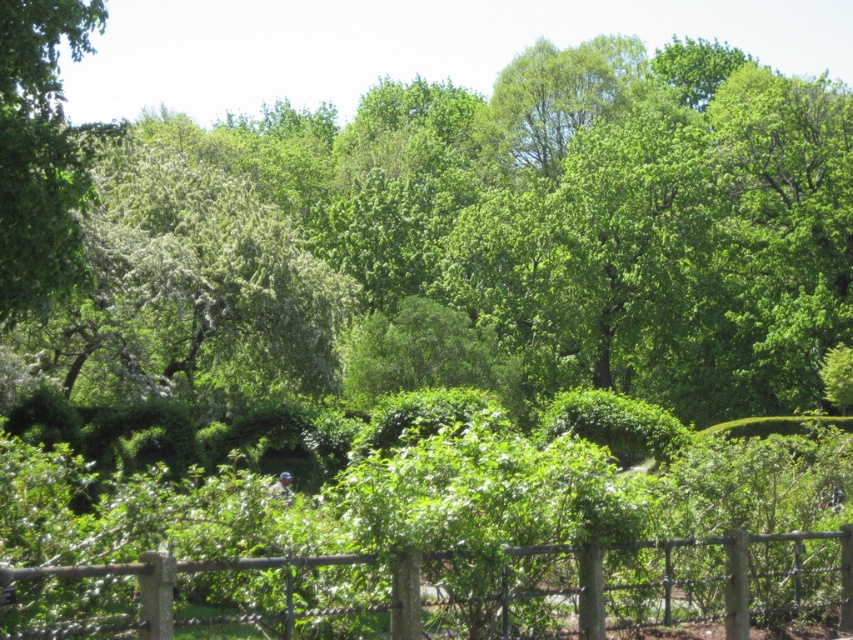
Who is lower down, green leafy tree at left or rustic wood fence at lower center?

rustic wood fence at lower center is below.

In the scene shown: How distant is green leafy tree at left from rustic wood fence at lower center?

green leafy tree at left and rustic wood fence at lower center are 28.32 feet apart.

Locate an element on the screen. This screenshot has width=853, height=640. green leafy tree at left is located at coordinates (39, 150).